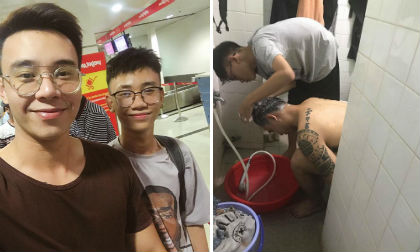
Where is `red bucket`? red bucket is located at coordinates click(x=270, y=197).